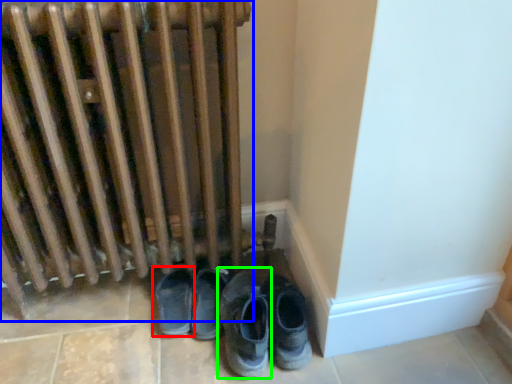
Question: Estimate the real-world distances between objects in this image. Which object is closer to footwear (highlighted by a red box), radiator (highlighted by a blue box) or footwear (highlighted by a green box)?

Choices:
 (A) radiator
 (B) footwear

Answer: (B)